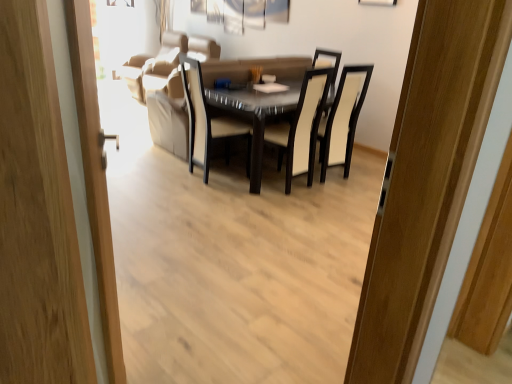
At what (x,y) coordinates should I click in order to perform the action: click on suede beige couch at upper center. Please return your answer as a coordinate pair (x, y). The width and height of the screenshot is (512, 384). Looking at the image, I should click on (166, 64).

What do you see at coordinates (207, 121) in the screenshot? I see `beige fabric chair at center, the first chair viewed from the left` at bounding box center [207, 121].

Where is `beige fabric chair at center, placed as the second chair when sorted from right to left`? beige fabric chair at center, placed as the second chair when sorted from right to left is located at coordinates (207, 121).

The height and width of the screenshot is (384, 512). What do you see at coordinates (37, 214) in the screenshot? I see `wooden door at left` at bounding box center [37, 214].

Describe the element at coordinates (164, 16) in the screenshot. I see `white fabric curtain at upper center` at that location.

Describe the element at coordinates (259, 124) in the screenshot. I see `glossy glass table at center` at that location.

Image resolution: width=512 pixels, height=384 pixels. What do you see at coordinates (343, 119) in the screenshot?
I see `black leather chair at center, arranged as the 2th chair when viewed from the left` at bounding box center [343, 119].

This screenshot has width=512, height=384. I want to click on suede beige couch at upper center, so click(x=166, y=64).

From a real-world perspective, who is located lower, suede beige couch at upper center or black leather chair at center, the first chair from the right?

In real-world perspective, suede beige couch at upper center is lower.

Is suede beige couch at upper center facing away from black leather chair at center, the first chair from the right?

No, suede beige couch at upper center is not facing the opposite direction of black leather chair at center, the first chair from the right.

Is suede beige couch at upper center directly adjacent to black leather chair at center, the first chair from the right?

No, suede beige couch at upper center is not with black leather chair at center, the first chair from the right.

Is suede beige couch at upper center further to camera compared to black leather chair at center, arranged as the 2th chair when viewed from the left?

Yes, suede beige couch at upper center is further from the viewer.

Is wooden door at left situated inside white fabric curtain at upper center or outside?

wooden door at left lies outside white fabric curtain at upper center.

From a real-world perspective, between wooden door at left and white fabric curtain at upper center, who is vertically lower?

From a 3D spatial view, wooden door at left is below.

Does wooden door at left appear on the left side of white fabric curtain at upper center?

No.

Who is bigger, black leather chair at center, the first chair from the right, or suede beige couch at upper center?

suede beige couch at upper center is bigger.

In terms of height, does black leather chair at center, the first chair from the right, look taller or shorter compared to suede beige couch at upper center?

Considering their sizes, black leather chair at center, the first chair from the right, has more height than suede beige couch at upper center.

From the picture: Looking at their sizes, would you say black leather chair at center, the first chair from the right, is wider or thinner than suede beige couch at upper center?

black leather chair at center, the first chair from the right, is thinner than suede beige couch at upper center.

Based on the photo, is wooden door at left with beige fabric chair at center, the first chair viewed from the left?

They are not placed beside each other.

Does wooden door at left lie behind beige fabric chair at center, placed as the second chair when sorted from right to left?

No, it is not.

Is beige fabric chair at center, the first chair viewed from the left, facing towards suede beige couch at upper center?

No, beige fabric chair at center, the first chair viewed from the left, is not aimed at suede beige couch at upper center.

From a real-world perspective, is beige fabric chair at center, placed as the second chair when sorted from right to left, below suede beige couch at upper center?

Incorrect, from a real-world perspective, beige fabric chair at center, placed as the second chair when sorted from right to left, is higher than suede beige couch at upper center.

Based on their positions, is beige fabric chair at center, placed as the second chair when sorted from right to left, located to the left or right of suede beige couch at upper center?

Based on their positions, beige fabric chair at center, placed as the second chair when sorted from right to left, is located to the right of suede beige couch at upper center.

Does beige fabric chair at center, placed as the second chair when sorted from right to left, have a smaller size compared to suede beige couch at upper center?

Indeed, beige fabric chair at center, placed as the second chair when sorted from right to left, has a smaller size compared to suede beige couch at upper center.

Considering the sizes of white fabric curtain at upper center and black leather chair at center, the first chair from the right, in the image, is white fabric curtain at upper center taller or shorter than black leather chair at center, the first chair from the right,?

In the image, white fabric curtain at upper center appears to be shorter than black leather chair at center, the first chair from the right.

Which object is thinner, white fabric curtain at upper center or black leather chair at center, the first chair from the right?

With smaller width is white fabric curtain at upper center.

From a real-world perspective, is white fabric curtain at upper center physically located above or below black leather chair at center, arranged as the 2th chair when viewed from the left?

From a real-world perspective, white fabric curtain at upper center is physically above black leather chair at center, arranged as the 2th chair when viewed from the left.

Is white fabric curtain at upper center bigger than black leather chair at center, the first chair from the right?

No, white fabric curtain at upper center is not bigger than black leather chair at center, the first chair from the right.

Is point (323, 79) closer to camera compared to point (192, 75)?

Yes, it is.

Is glossy glass table at center behind beige fabric chair at center, placed as the second chair when sorted from right to left?

That is True.

From the image's perspective, is glossy glass table at center located above beige fabric chair at center, placed as the second chair when sorted from right to left?

No.

You are a GUI agent. You are given a task and a screenshot of the screen. Output one action in this format:
    pyautogui.click(x=<x>, y=<y>)
    Task: Click on the couch on the left of black leather chair at center, the first chair from the right
    
    Given the screenshot: What is the action you would take?
    pyautogui.click(x=166, y=64)

Identify the location of curtain located above the wooden door at left (from the image's perspective). This screenshot has width=512, height=384. (164, 16).

Looking at the image, which one is located closer to wooden door at left, suede beige couch at upper center or black leather chair at center, arranged as the 2th chair when viewed from the left?

Among the two, black leather chair at center, arranged as the 2th chair when viewed from the left, is located nearer to wooden door at left.

From the image, which object appears to be farther from suede beige couch at upper center, glossy glass table at center or white fabric curtain at upper center?

The object further to suede beige couch at upper center is glossy glass table at center.

Based on the photo, based on their spatial positions, is glossy glass table at center or black leather chair at center, the first chair from the right, closer to wooden door at left?

Among the two, glossy glass table at center is located nearer to wooden door at left.

Considering their positions, is glossy glass table at center positioned closer to black leather chair at center, arranged as the 2th chair when viewed from the left, than white fabric curtain at upper center?

glossy glass table at center.

In the scene shown: Which object lies further to the anchor point white fabric curtain at upper center, glossy glass table at center or black leather chair at center, arranged as the 2th chair when viewed from the left?

Among the two, black leather chair at center, arranged as the 2th chair when viewed from the left, is located further to white fabric curtain at upper center.

Which object lies further to the anchor point black leather chair at center, arranged as the 2th chair when viewed from the left, glossy glass table at center or suede beige couch at upper center?

suede beige couch at upper center lies further to black leather chair at center, arranged as the 2th chair when viewed from the left, than the other object.

Considering their positions, is suede beige couch at upper center positioned further to black leather chair at center, the first chair from the right, than beige fabric chair at center, placed as the second chair when sorted from right to left?

suede beige couch at upper center is positioned further to the anchor black leather chair at center, the first chair from the right.

From the image, which object appears to be farther from beige fabric chair at center, placed as the second chair when sorted from right to left, glossy glass table at center or wooden door at left?

wooden door at left is positioned further to the anchor beige fabric chair at center, placed as the second chair when sorted from right to left.

What are the coordinates of `chair positioned between glossy glass table at center and white fabric curtain at upper center from near to far` in the screenshot? It's located at pos(343,119).

Locate an element on the screen. kitchen & dining room table between wooden door at left and black leather chair at center, arranged as the 2th chair when viewed from the left, from front to back is located at coordinates (259, 124).

At what (x,y) coordinates should I click in order to perform the action: click on couch between black leather chair at center, arranged as the 2th chair when viewed from the left, and white fabric curtain at upper center, along the z-axis. Please return your answer as a coordinate pair (x, y). Looking at the image, I should click on (166, 64).

The image size is (512, 384). I want to click on kitchen & dining room table located between beige fabric chair at center, the first chair viewed from the left, and suede beige couch at upper center in the depth direction, so click(259, 124).